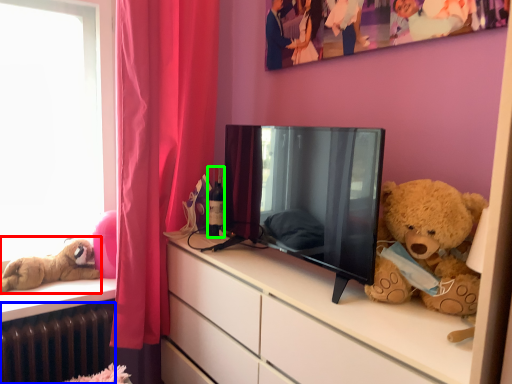
Question: Which object is the farthest from teddy bear (highlighted by a red box)? Choose among these: radiator (highlighted by a blue box) or bottle (highlighted by a green box).

Choices:
 (A) radiator
 (B) bottle

Answer: (B)